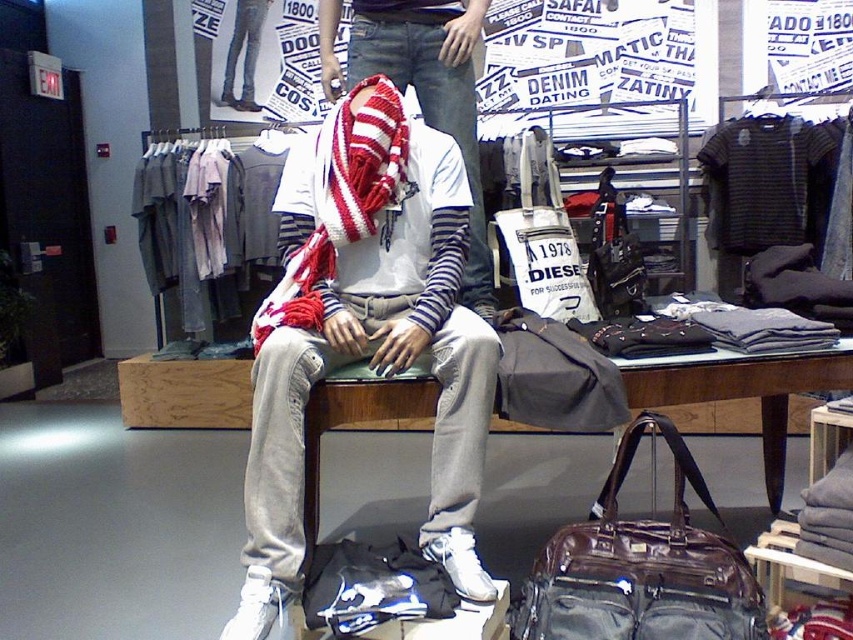
Question: Does knit scarf at center come in front of striped cotton scarf at center?

Choices:
 (A) yes
 (B) no

Answer: (A)

Question: Which point is closer to the camera taking this photo?

Choices:
 (A) (515, 212)
 (B) (573, 380)
 (C) (248, 570)
 (D) (482, 285)

Answer: (C)

Question: Does striped cotton scarf at center appear over white canvas tote at center?

Choices:
 (A) yes
 (B) no

Answer: (A)

Question: Among these objects, which one is nearest to the camera?

Choices:
 (A) matte gray duffel bag at center
 (B) leather suitcase at lower center

Answer: (B)

Question: Considering the relative positions of knit scarf at center and white canvas tote at center in the image provided, where is knit scarf at center located with respect to white canvas tote at center?

Choices:
 (A) above
 (B) below

Answer: (B)

Question: Among these points, which one is farthest from the camera?

Choices:
 (A) (509, 241)
 (B) (454, 516)
 (C) (669, 614)

Answer: (A)